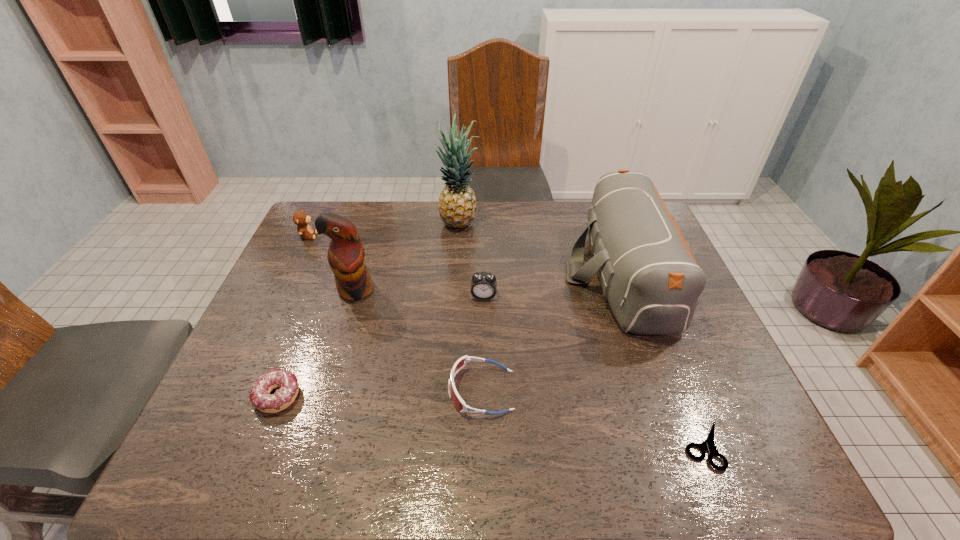
You are a GUI agent. You are given a task and a screenshot of the screen. Output one action in this format:
    pyautogui.click(x=<x>, y=<y>)
    Task: Click on the tallest object
    
    Given the screenshot: What is the action you would take?
    (457, 202)

I want to click on parrot, so click(x=346, y=256).

The width and height of the screenshot is (960, 540). I want to click on duffel bag, so click(647, 272).

The width and height of the screenshot is (960, 540). Identify the location of teddy bear. (300, 218).

Where is `alarm clock`? alarm clock is located at coordinates (483, 284).

What are the coordinates of `goggles` in the screenshot? It's located at (458, 402).

At what (x,y) coordinates should I click in order to perform the action: click on doughnut. Please return your answer as a coordinate pair (x, y). Image resolution: width=960 pixels, height=540 pixels. Looking at the image, I should click on (260, 398).

Find the location of `the nearest object`. the nearest object is located at coordinates (709, 444).

This screenshot has height=540, width=960. Find the location of `shears`. shears is located at coordinates tap(709, 444).

Where is `vacant region located on the left of the pineapple`? The width and height of the screenshot is (960, 540). vacant region located on the left of the pineapple is located at coordinates (354, 225).